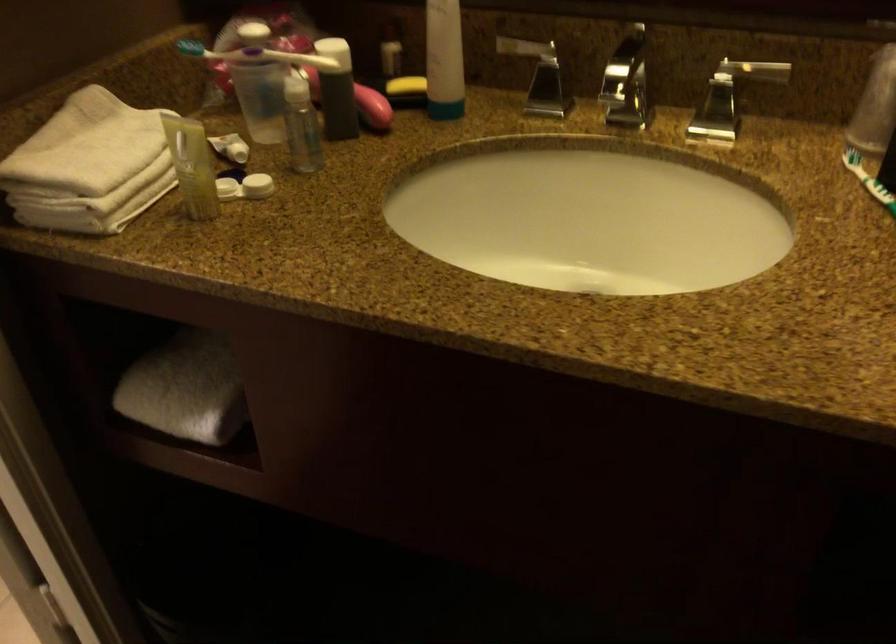
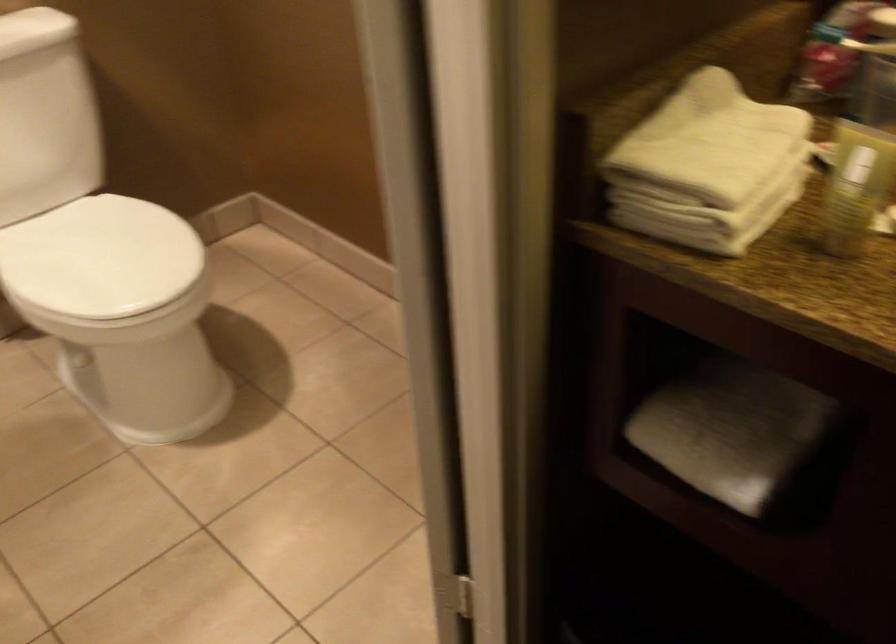
Find the pixel in the second image that matches the point at 92,146 in the first image.

(711, 140)